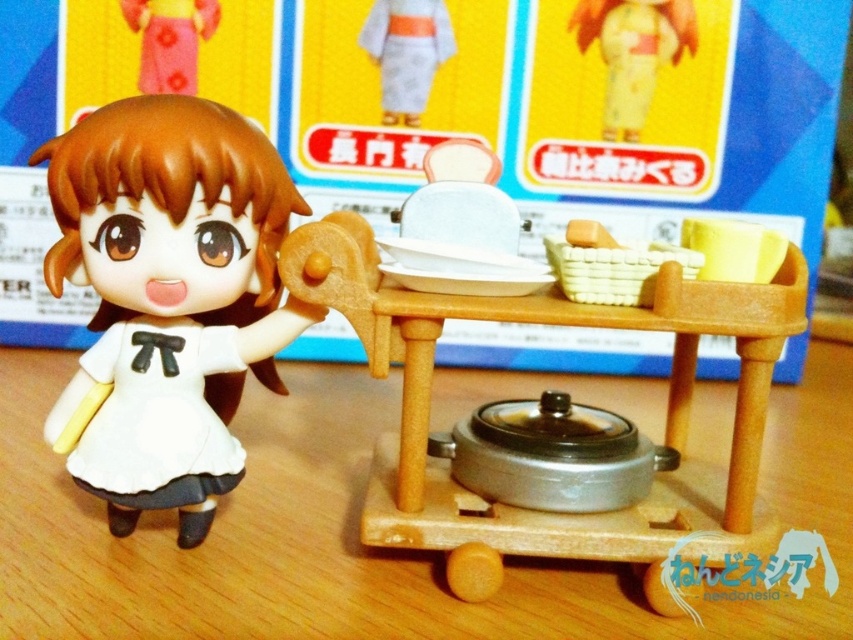
Looking at this image, who is higher up, white matte doll at left or wooden table at center?

white matte doll at left

How far apart are white matte doll at left and wooden table at center?

A distance of 7.69 inches exists between white matte doll at left and wooden table at center.

Locate an element on the screen. white matte doll at left is located at coordinates (169, 296).

Which of these two, yellow matte kimono at upper center or pink fabric dress at upper left, stands taller?

yellow matte kimono at upper center

Which is more to the right, yellow matte kimono at upper center or pink fabric dress at upper left?

yellow matte kimono at upper center is more to the right.

You are a GUI agent. You are given a task and a screenshot of the screen. Output one action in this format:
    pyautogui.click(x=<x>, y=<y>)
    Task: Click on the yellow matte kimono at upper center
    The width and height of the screenshot is (853, 640).
    Given the screenshot: What is the action you would take?
    pyautogui.click(x=633, y=51)

Does white fabric kimono at upper center have a larger size compared to yellow matte cup at upper right?

No.

From the picture: Which is below, white fabric kimono at upper center or yellow matte cup at upper right?

yellow matte cup at upper right

Who is more distant from viewer, (361, 26) or (749, 269)?

Point (361, 26)

Where is `white fabric kimono at upper center`? white fabric kimono at upper center is located at coordinates (405, 52).